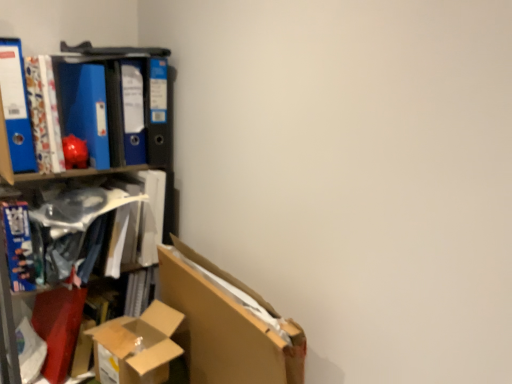
Question: Is the position of blue matte folder at left, which appears as the third paperback book when viewed from the right, less distant than that of blue matte folder at upper left, positioned as the second paperback book in right-to-left order?

Choices:
 (A) no
 (B) yes

Answer: (B)

Question: Does blue matte folder at left, arranged as the 1th paperback book when viewed from the left, have a greater width compared to blue matte folder at upper left, positioned as the second paperback book in right-to-left order?

Choices:
 (A) no
 (B) yes

Answer: (A)

Question: Can you confirm if blue matte folder at left, which appears as the third paperback book when viewed from the right, is taller than blue matte folder at upper left, positioned as the second paperback book in right-to-left order?

Choices:
 (A) yes
 (B) no

Answer: (A)

Question: Is blue matte folder at left, arranged as the 1th paperback book when viewed from the left, far away from blue matte folder at upper left, positioned as the second paperback book in right-to-left order?

Choices:
 (A) yes
 (B) no

Answer: (B)

Question: From a real-world perspective, is blue matte folder at left, arranged as the 1th paperback book when viewed from the left, positioned under blue matte folder at upper left, positioned as the second paperback book in right-to-left order, based on gravity?

Choices:
 (A) no
 (B) yes

Answer: (A)

Question: From the image's perspective, is blue matte folder at left, which appears as the third paperback book when viewed from the right, above blue matte folder at upper left, positioned as the second paperback book in right-to-left order?

Choices:
 (A) no
 (B) yes

Answer: (A)

Question: Could you tell me if cardboard box at lower left is turned towards blue matte folder at upper left, positioned as the second paperback book in right-to-left order?

Choices:
 (A) no
 (B) yes

Answer: (A)

Question: Can you confirm if cardboard box at lower left is bigger than blue matte folder at upper left, positioned as the second paperback book in right-to-left order?

Choices:
 (A) no
 (B) yes

Answer: (B)

Question: Is cardboard box at lower left at the right side of blue matte folder at upper left, positioned as the second paperback book in right-to-left order?

Choices:
 (A) no
 (B) yes

Answer: (B)

Question: Considering the relative positions of cardboard box at lower left and blue matte folder at upper left, positioned as the second paperback book in right-to-left order, in the image provided, is cardboard box at lower left in front of blue matte folder at upper left, positioned as the second paperback book in right-to-left order,?

Choices:
 (A) yes
 (B) no

Answer: (A)

Question: Is blue matte folder at upper left, positioned as the second paperback book in right-to-left order, a part of cardboard box at lower left?

Choices:
 (A) yes
 (B) no

Answer: (B)

Question: From a real-world perspective, is cardboard box at lower left over blue matte folder at upper left, positioned as the second paperback book in right-to-left order?

Choices:
 (A) no
 (B) yes

Answer: (A)

Question: Does blue glossy book at left, acting as the second book starting from the right, lie in front of cardboard box at lower left?

Choices:
 (A) yes
 (B) no

Answer: (B)